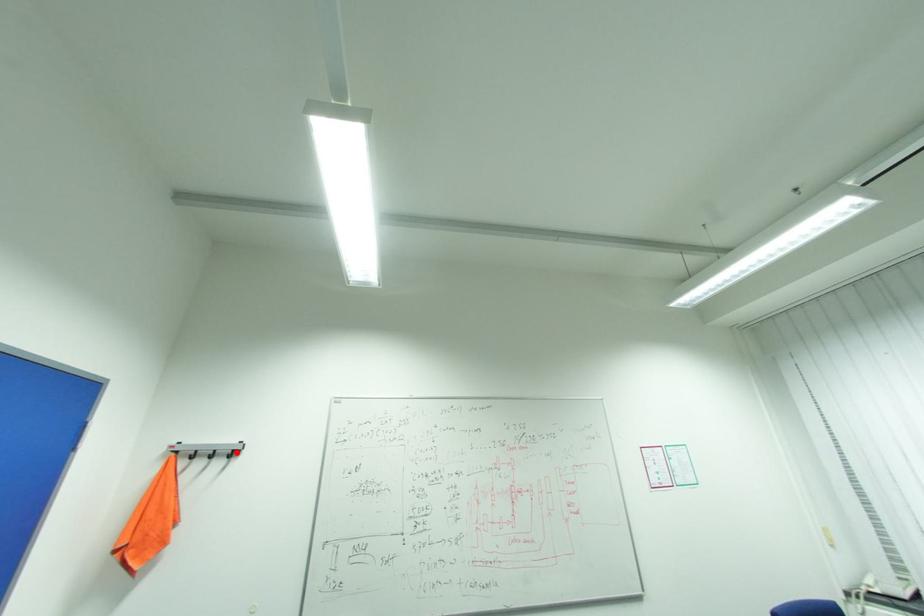
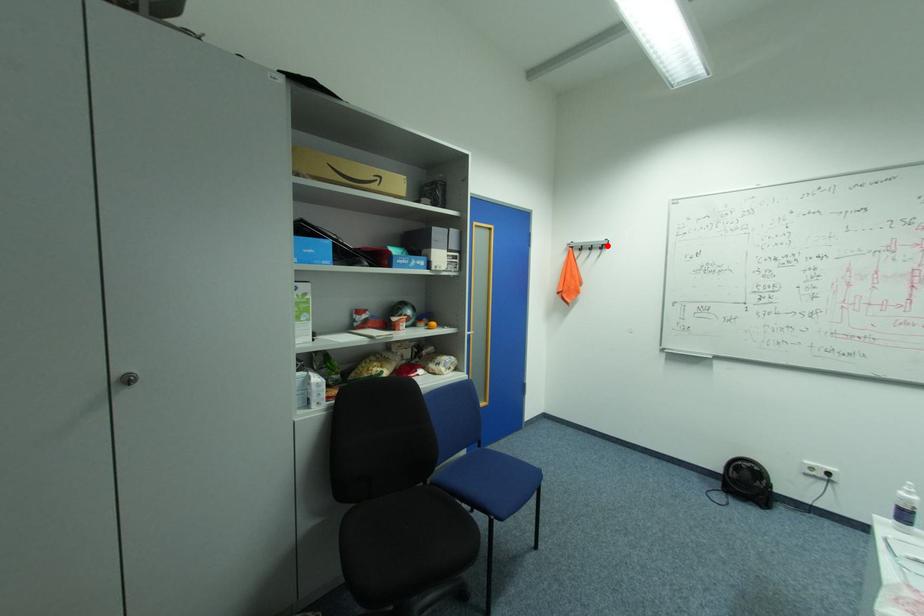
I am providing you with two images of the same scene from different viewpoints. A red point is marked on the first image and another point is marked on the second image. Is the red point in image1 aligned with the point shown in image2?

Yes